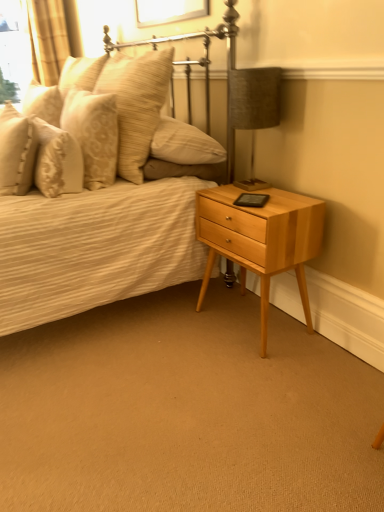
Locate an element on the screen. vacant space in front of textured fabric lampshade at upper right is located at coordinates (266, 197).